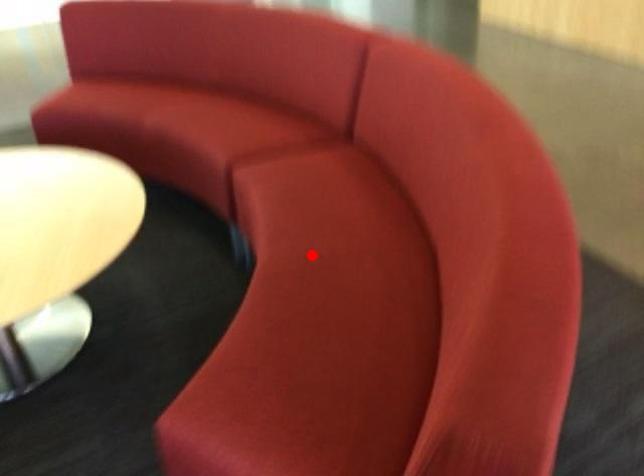
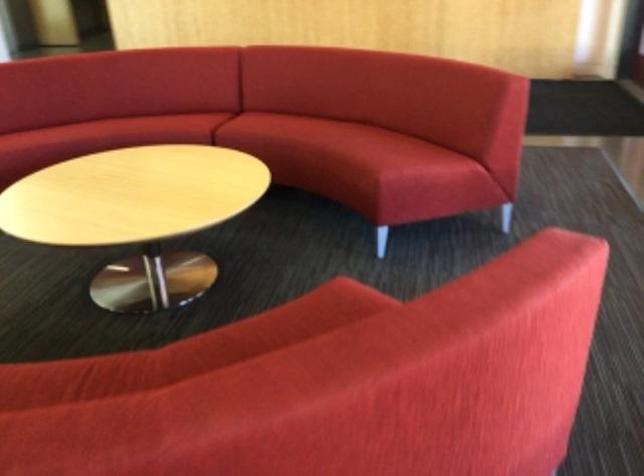
Locate, in the second image, the point that corresponds to the highlighted location in the first image.

(326, 134)